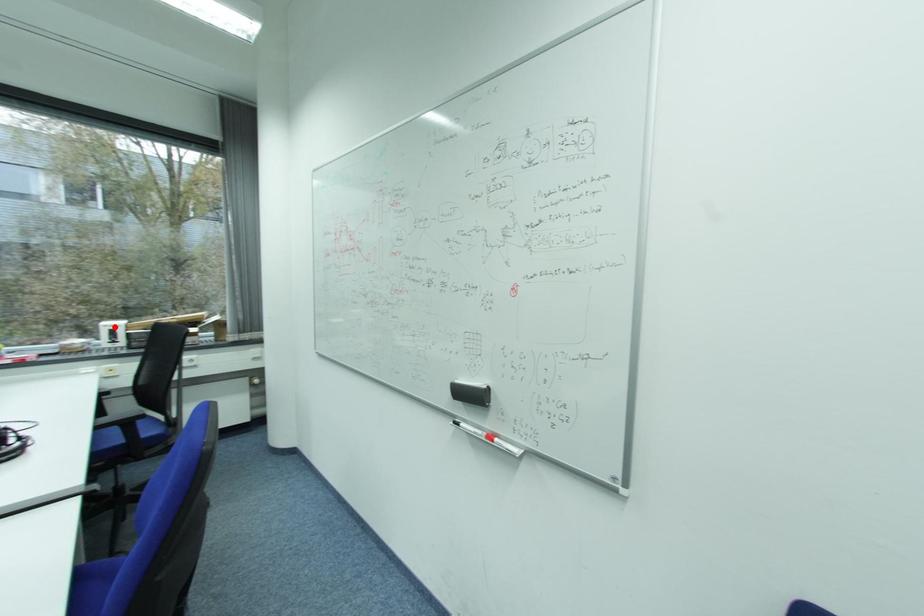
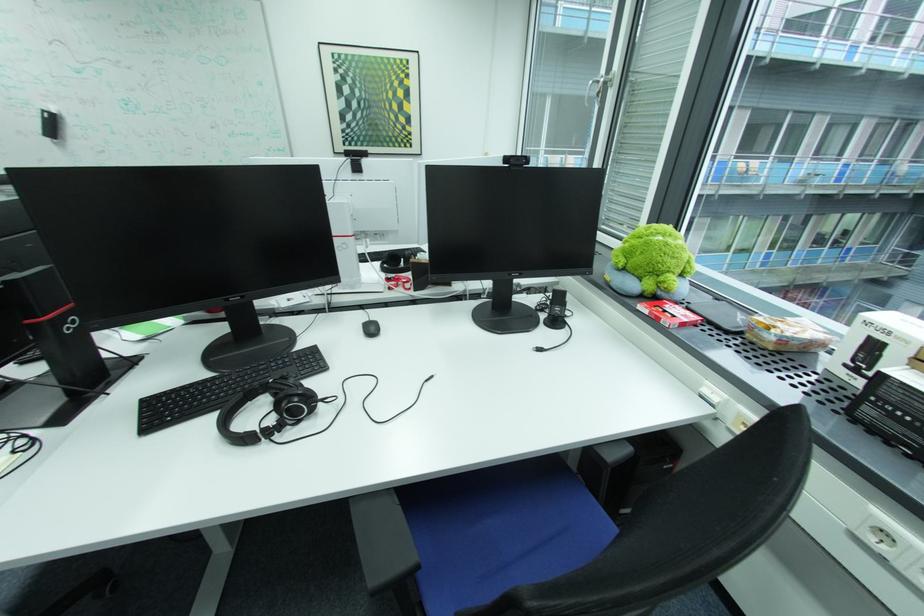
Locate, in the second image, the point that corresponds to the highlighted location in the first image.

(876, 323)